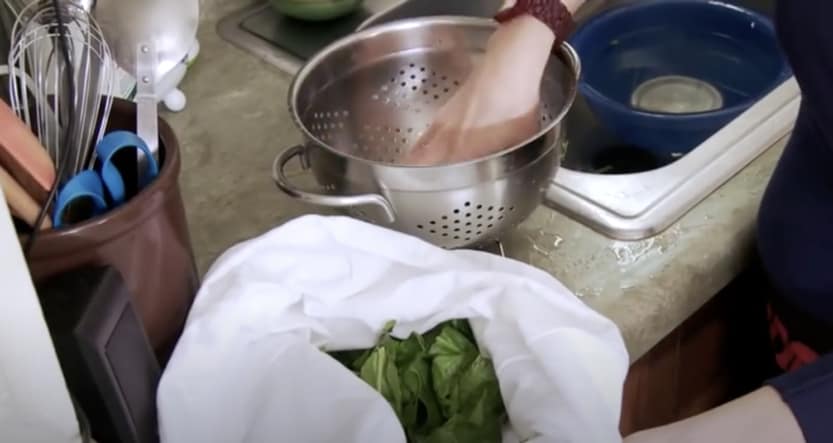
Where is `silver colander`? This screenshot has width=833, height=443. silver colander is located at coordinates (431, 186).